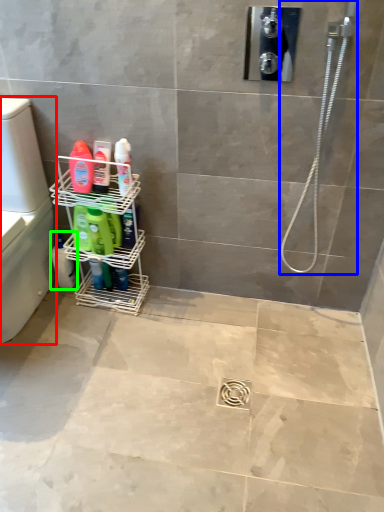
Question: Which object is the closest to the washer (highlighted by a red box)? Choose among these: shower (highlighted by a blue box) or cleaning product (highlighted by a green box).

Choices:
 (A) shower
 (B) cleaning product

Answer: (B)